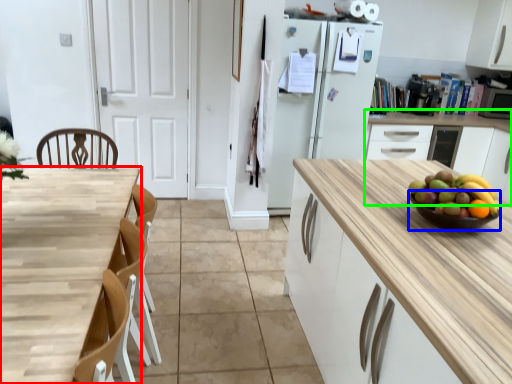
Question: Which object is positioned closest to countertop (highlighted by a red box)? Select from glass bowl (highlighted by a blue box) and cabinetry (highlighted by a green box).

Choices:
 (A) glass bowl
 (B) cabinetry

Answer: (A)